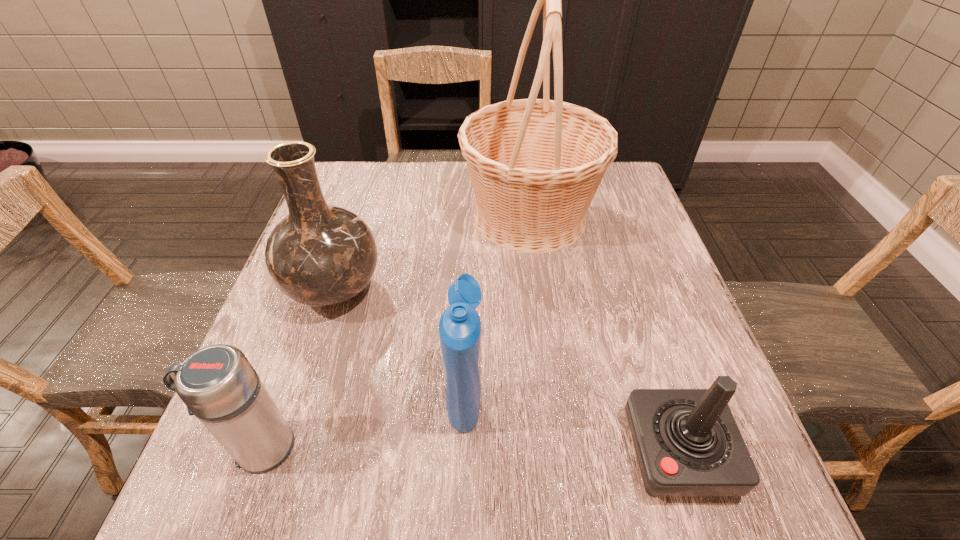
Locate an element on the screen. The width and height of the screenshot is (960, 540). object that is at the near right corner is located at coordinates (687, 442).

Where is `vacant area at the far edge of the desktop`? vacant area at the far edge of the desktop is located at coordinates (405, 179).

Where is `free space at the near edge of the desktop`? free space at the near edge of the desktop is located at coordinates (328, 513).

At what (x,y) coordinates should I click in order to perform the action: click on vacant space at the right edge of the desktop. Please return your answer as a coordinate pair (x, y). This screenshot has height=540, width=960. Looking at the image, I should click on (642, 366).

Identify the location of vacant space at the far left corner of the desktop. This screenshot has height=540, width=960. (385, 172).

In the image, there is a desktop. Identify the location of vacant space at the far right corner. (635, 202).

Find the location of a particular element. This screenshot has width=960, height=540. empty location between the joystick and the thermos bottle is located at coordinates (468, 449).

Identify the location of vacant area that lies between the tallest object and the shampoo. This screenshot has height=540, width=960. [497, 305].

Find the location of a particular element. The width and height of the screenshot is (960, 540). empty space that is in between the basket and the thermos bottle is located at coordinates point(395,332).

You are a GUI agent. You are given a task and a screenshot of the screen. Output one action in this format:
    pyautogui.click(x=<x>, y=<y>)
    Task: Click on the vacant space that is in between the shampoo and the second tallest object
    The height and width of the screenshot is (540, 960).
    Given the screenshot: What is the action you would take?
    pyautogui.click(x=400, y=342)